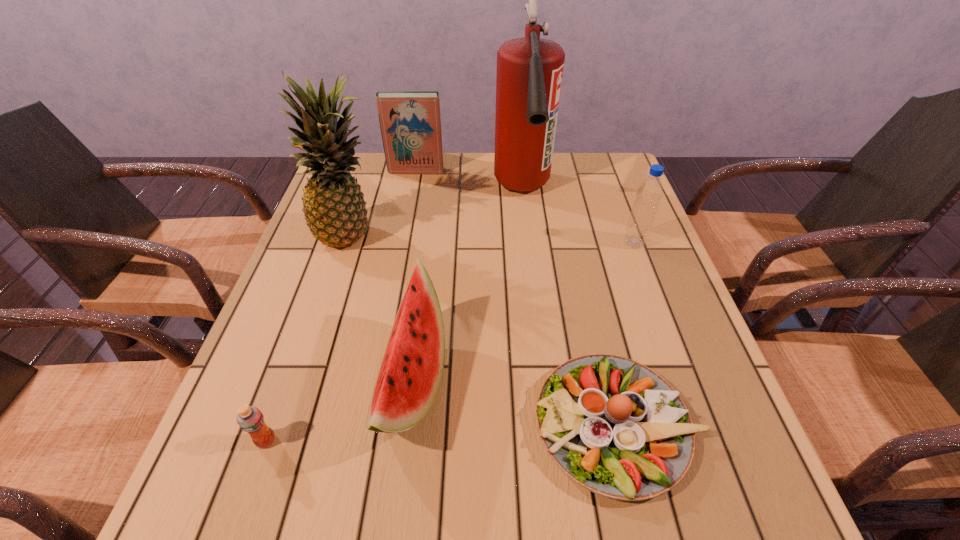
The height and width of the screenshot is (540, 960). Find the location of `vacant region located 0.360m on the back of the water bottle`. vacant region located 0.360m on the back of the water bottle is located at coordinates (604, 164).

Where is `free spot located on the outer rind of the third shortest object`? The width and height of the screenshot is (960, 540). free spot located on the outer rind of the third shortest object is located at coordinates (501, 382).

What are the coordinates of `free space located 0.280m on the back of the orange juice` in the screenshot? It's located at (312, 310).

The height and width of the screenshot is (540, 960). I want to click on vacant region located 0.320m on the back of the salad plate, so click(578, 254).

Identify the location of fire extinguisher situated at the far edge. This screenshot has width=960, height=540. (529, 75).

At what (x,y) coordinates should I click in order to perform the action: click on hardback book at the far edge. Please return your answer as a coordinate pair (x, y). The image size is (960, 540). Looking at the image, I should click on (410, 123).

Where is `object at the near edge`? The height and width of the screenshot is (540, 960). object at the near edge is located at coordinates (614, 426).

The image size is (960, 540). I want to click on pineapple at the left edge, so click(x=333, y=204).

This screenshot has width=960, height=540. I want to click on orange juice located in the left edge section of the desktop, so click(x=250, y=419).

You are a GUI agent. You are given a task and a screenshot of the screen. Output one action in this format:
    pyautogui.click(x=<x>, y=<y>)
    Task: Click on the water bottle located at the right edge
    
    Given the screenshot: What is the action you would take?
    pyautogui.click(x=649, y=193)